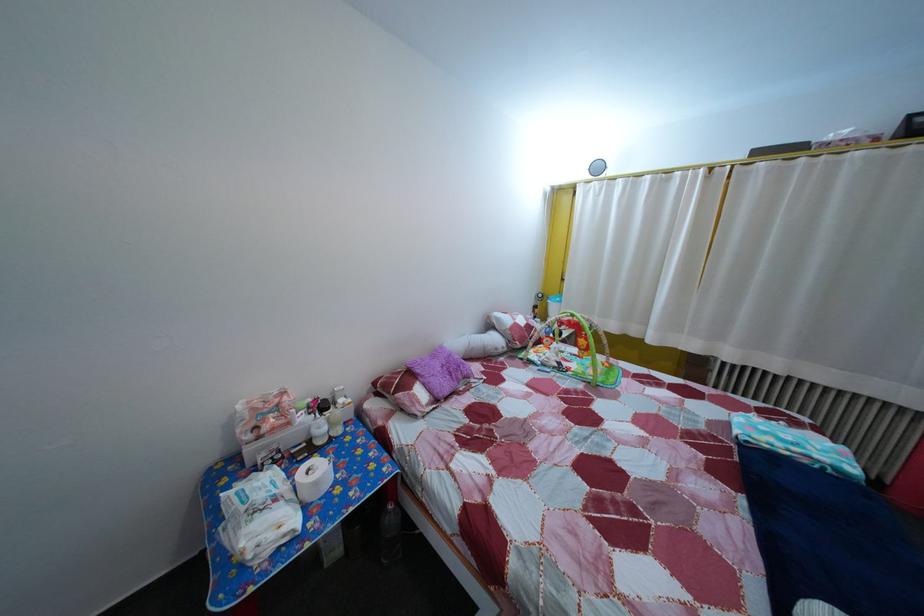
The image size is (924, 616). Describe the element at coordinates (259, 515) in the screenshot. I see `the package of diapers` at that location.